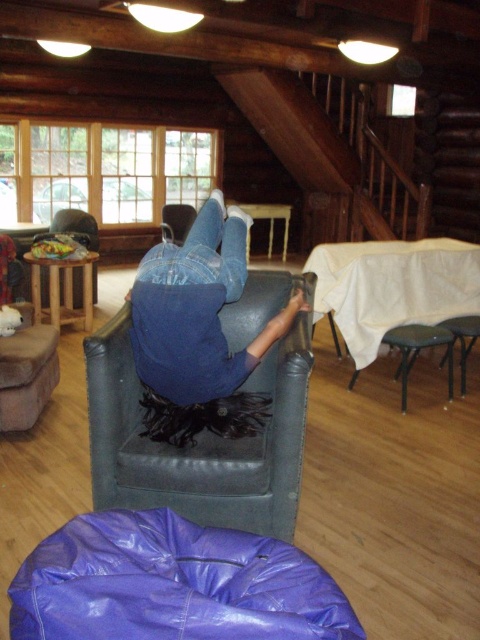
Question: Which point is closer to the camera taking this photo?

Choices:
 (A) (158, 353)
 (B) (260, 550)

Answer: (B)

Question: Can you confirm if purple vinyl bean bag at lower center is positioned below blue leather chair at center?

Choices:
 (A) no
 (B) yes

Answer: (B)

Question: Is purple vinyl bean bag at lower center above blue leather chair at center?

Choices:
 (A) no
 (B) yes

Answer: (A)

Question: Which point appears farthest from the camera in this image?

Choices:
 (A) (50, 621)
 (B) (149, 252)

Answer: (B)

Question: Is purple vinyl bean bag at lower center wider than blue leather chair at center?

Choices:
 (A) no
 (B) yes

Answer: (B)